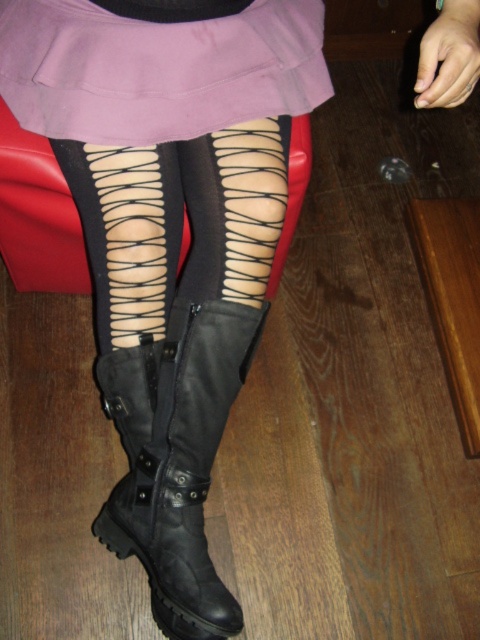
Consider the image. Who is lower down, black leather boots at lower center or matte purple skirt at upper center?

black leather boots at lower center is lower down.

Who is higher up, black leather boots at lower center or matte purple skirt at upper center?

matte purple skirt at upper center

Does point (22, 76) come behind point (247, 74)?

Yes.

This screenshot has width=480, height=640. Find the location of `black leather boots at lower center`. black leather boots at lower center is located at coordinates 169,234.

Between black leather boots at lower center and black leather boot at lower center, which one appears on the right side from the viewer's perspective?

black leather boots at lower center

Is black leather boots at lower center positioned in front of black leather boot at lower center?

Yes, black leather boots at lower center is closer to the viewer.

Is point (268, 266) positioned after point (197, 381)?

Yes, it is behind point (197, 381).

Where is `black leather boots at lower center`? The height and width of the screenshot is (640, 480). black leather boots at lower center is located at coordinates (169, 234).

Is point (157, 132) behind point (206, 324)?

No, (157, 132) is closer to viewer.

In the scene shown: Which is more to the right, matte purple skirt at upper center or black leather boot at lower center?

matte purple skirt at upper center is more to the right.

Where is `matte purple skirt at upper center`? The width and height of the screenshot is (480, 640). matte purple skirt at upper center is located at coordinates (156, 68).